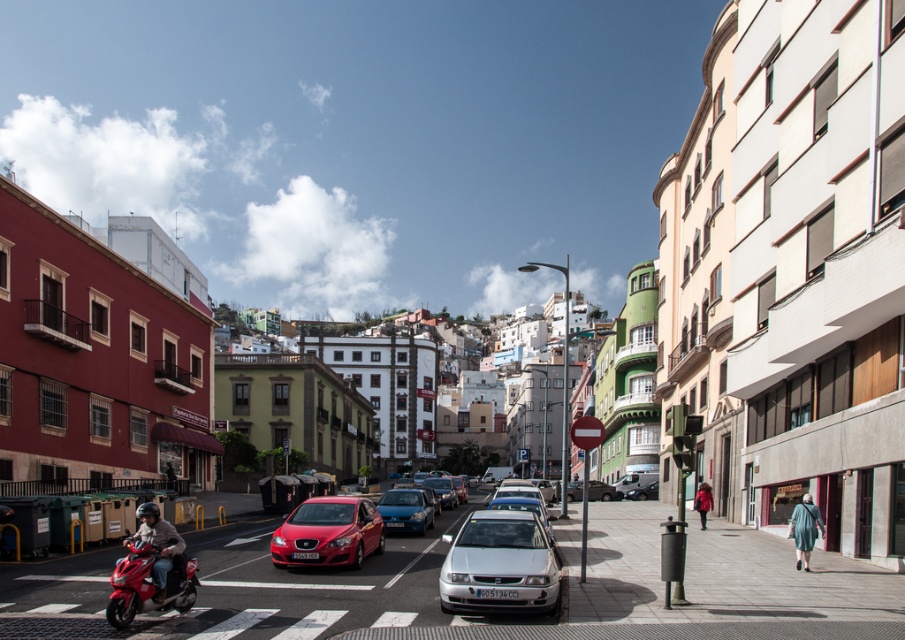
Based on the photo, does shiny red sedan at center come in front of blue metallic hatchback at center?

Yes.

Is shiny red sedan at center thinner than blue metallic hatchback at center?

Correct, shiny red sedan at center's width is less than blue metallic hatchback at center's.

Is point (310, 534) behind point (403, 492)?

No.

Where is `shiny red sedan at center`? shiny red sedan at center is located at coordinates (329, 532).

Is matte black motorcycle at lower left bigger than silver metallic van at center?

Incorrect, matte black motorcycle at lower left is not larger than silver metallic van at center.

Does matte black motorcycle at lower left have a greater height compared to silver metallic van at center?

No, matte black motorcycle at lower left is not taller than silver metallic van at center.

Find the location of a particular element. Image resolution: width=905 pixels, height=640 pixels. matte black motorcycle at lower left is located at coordinates (159, 545).

Who is positioned more to the left, blue metallic hatchback at center or silver metallic van at center?

blue metallic hatchback at center is more to the left.

Is blue metallic hatchback at center closer to the viewer compared to silver metallic van at center?

Yes, it is in front of silver metallic van at center.

Where is `blue metallic hatchback at center`? blue metallic hatchback at center is located at coordinates (406, 509).